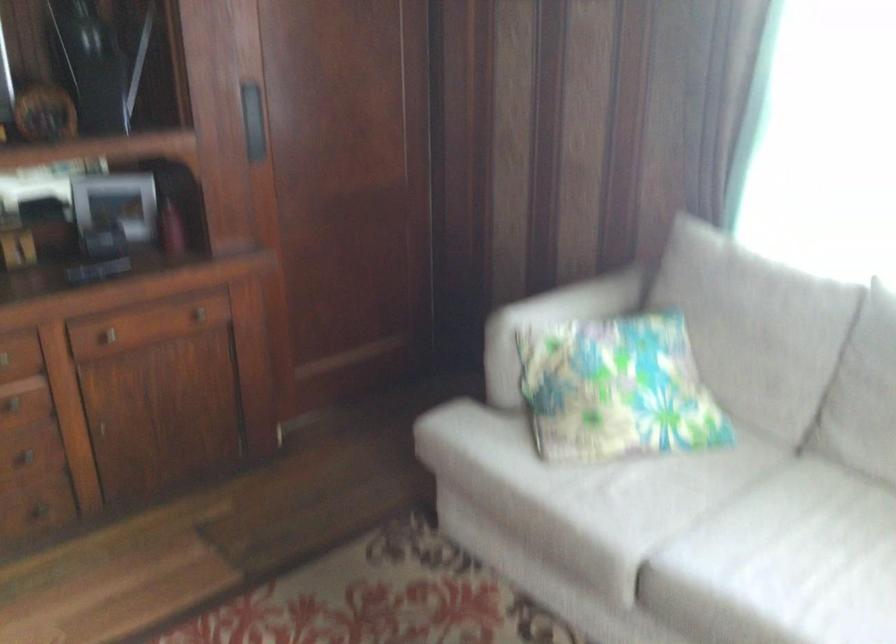
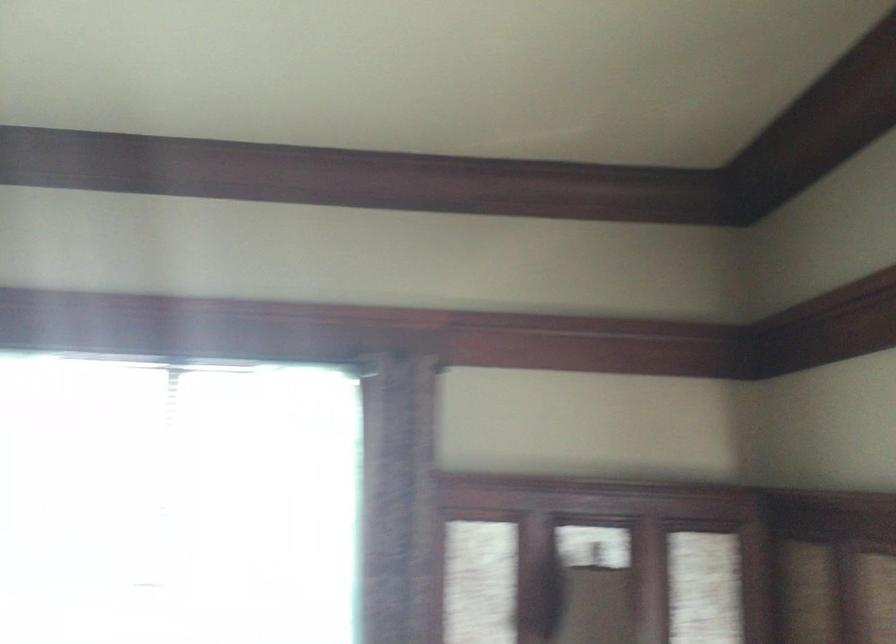
The images are taken continuously from a first-person perspective. In which direction is your viewpoint rotating?

The camera's rotation is toward right-up.